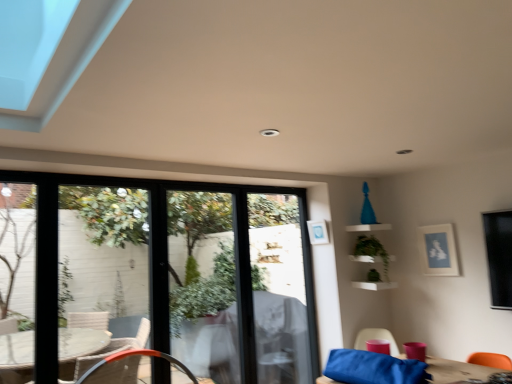
Question: Can you confirm if white wicker chair at lower left, the second chair in the right-to-left sequence, is thinner than matte blue picture frame at upper right, the second picture frame positioned from the left?

Choices:
 (A) yes
 (B) no

Answer: (B)

Question: Would you consider white wicker chair at lower left, the second chair in the right-to-left sequence, to be distant from matte blue picture frame at upper right, the first picture frame in the right-to-left sequence?

Choices:
 (A) no
 (B) yes

Answer: (B)

Question: Does white wicker chair at lower left, acting as the first chair starting from the left, have a greater width compared to matte blue picture frame at upper right, the first picture frame in the right-to-left sequence?

Choices:
 (A) yes
 (B) no

Answer: (A)

Question: Is matte blue picture frame at upper right, the second picture frame positioned from the left, inside white wicker chair at lower left, acting as the first chair starting from the left?

Choices:
 (A) no
 (B) yes

Answer: (A)

Question: Does white wicker chair at lower left, acting as the first chair starting from the left, have a larger size compared to matte blue picture frame at upper right, the first picture frame in the right-to-left sequence?

Choices:
 (A) yes
 (B) no

Answer: (A)

Question: Considering the positions of matte pink cup at lower right, the 2th chair from the left, and clear glass door at center in the image, is matte pink cup at lower right, the 2th chair from the left, taller or shorter than clear glass door at center?

Choices:
 (A) short
 (B) tall

Answer: (A)

Question: In terms of size, does matte pink cup at lower right, the 2th chair from the left, appear bigger or smaller than clear glass door at center?

Choices:
 (A) small
 (B) big

Answer: (A)

Question: From the image's perspective, is matte pink cup at lower right, which is the first chair in right-to-left order, positioned above or below clear glass door at center?

Choices:
 (A) above
 (B) below

Answer: (B)

Question: Is point (376, 334) positioned closer to the camera than point (216, 360)?

Choices:
 (A) farther
 (B) closer

Answer: (A)

Question: Is clear glass door at center situated inside green matte plant at upper right or outside?

Choices:
 (A) inside
 (B) outside

Answer: (B)

Question: Visually, is clear glass door at center positioned to the left or to the right of green matte plant at upper right?

Choices:
 (A) right
 (B) left

Answer: (B)

Question: In terms of height, does clear glass door at center look taller or shorter compared to green matte plant at upper right?

Choices:
 (A) tall
 (B) short

Answer: (A)

Question: From a real-world perspective, is clear glass door at center above or below green matte plant at upper right?

Choices:
 (A) below
 (B) above

Answer: (A)

Question: Visually, is green matte plant at upper right positioned to the left or to the right of matte blue picture frame at upper right, the first picture frame in the right-to-left sequence?

Choices:
 (A) left
 (B) right

Answer: (A)

Question: In terms of width, does green matte plant at upper right look wider or thinner when compared to matte blue picture frame at upper right, the first picture frame in the right-to-left sequence?

Choices:
 (A) thin
 (B) wide

Answer: (B)